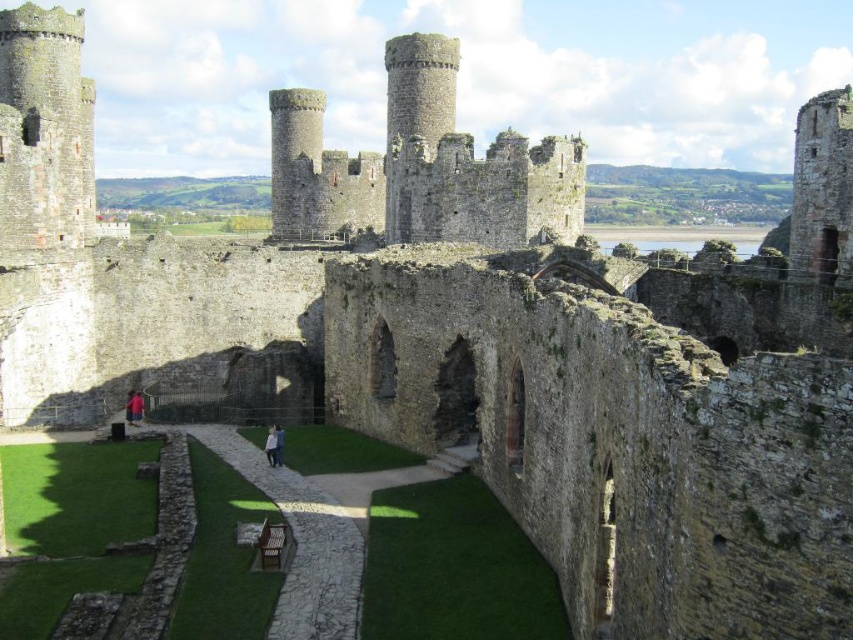
Question: Is rustic stone castle at center thinner than light brown leather jacket at center?

Choices:
 (A) no
 (B) yes

Answer: (A)

Question: From the image, what is the correct spatial relationship of rustic stone castle at center in relation to light brown leather jacket at center?

Choices:
 (A) below
 (B) above

Answer: (B)

Question: Is the position of rustic stone castle at center more distant than that of pink fabric at center?

Choices:
 (A) yes
 (B) no

Answer: (A)

Question: Estimate the real-world distances between objects in this image. Which object is farther from the light brown leather jacket at center?

Choices:
 (A) pink fabric at center
 (B) rustic stone castle at center

Answer: (B)

Question: Among these points, which one is nearest to the camera?

Choices:
 (A) (492, 154)
 (B) (270, 451)
 (C) (280, 445)

Answer: (C)

Question: Which object is positioned farthest from the pink fabric at center?

Choices:
 (A) rustic stone castle at center
 (B) light brown leather jacket at center

Answer: (A)